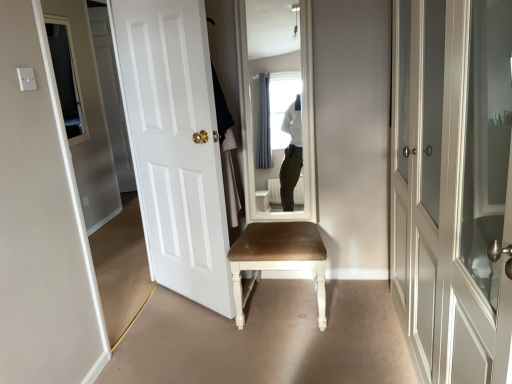
This screenshot has width=512, height=384. In order to click on vacant area situated to the left side of brown leather chair at center in this screenshot , I will do `click(192, 331)`.